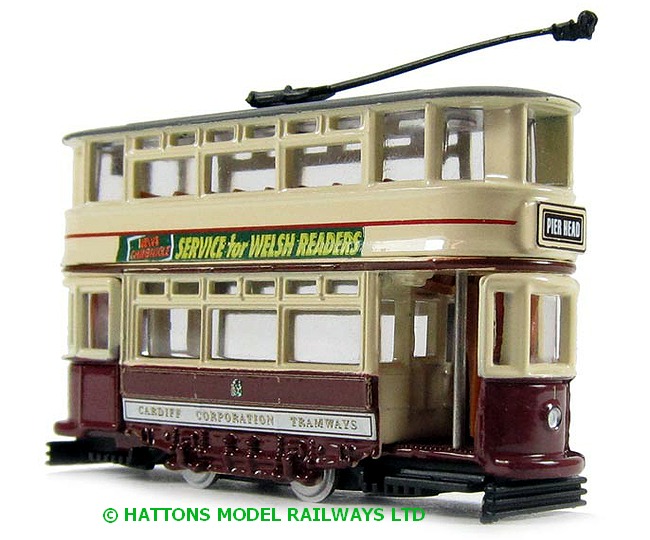
Where is `bracket`? The width and height of the screenshot is (650, 540). bracket is located at coordinates (296, 87).